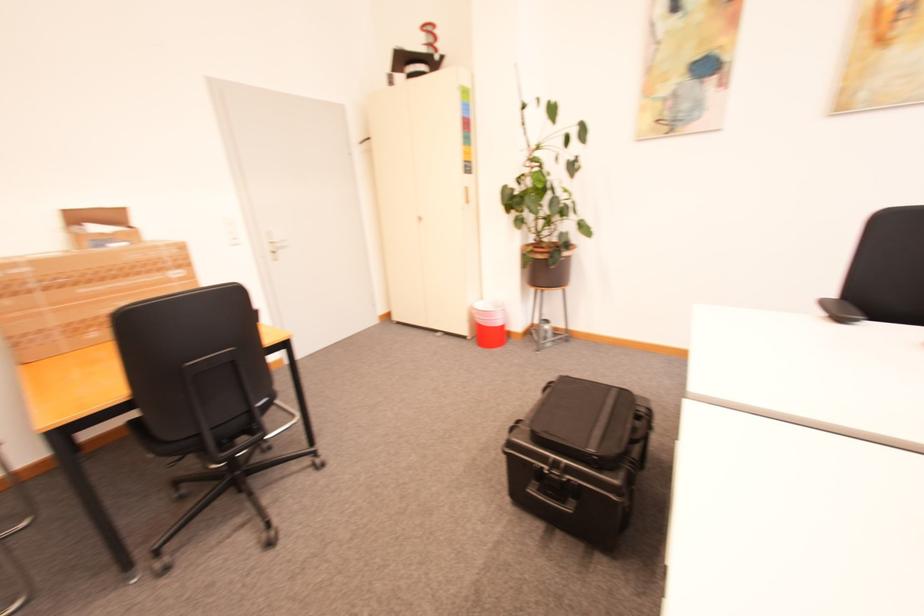
What do you see at coordinates (198, 390) in the screenshot? I see `a chair sitting surface` at bounding box center [198, 390].